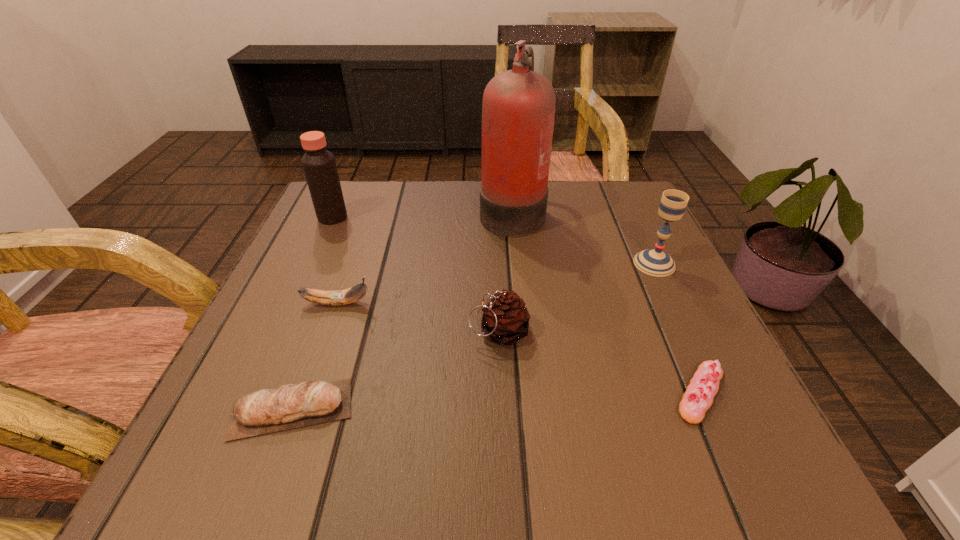
Where is `free area in between the fire extinguisher and the third farthest object`? The image size is (960, 540). free area in between the fire extinguisher and the third farthest object is located at coordinates (583, 237).

Image resolution: width=960 pixels, height=540 pixels. What are the coordinates of `vacant area that lies between the chalice and the tallest object` in the screenshot? It's located at [x=583, y=237].

Find the location of a particular element. This screenshot has width=960, height=540. vacant point located between the fifth tallest object and the fire extinguisher is located at coordinates (424, 257).

The image size is (960, 540). In order to click on free space between the eclair and the fourth tallest object in this screenshot , I will do `click(600, 362)`.

Find the location of a particular element. This screenshot has height=540, width=960. vacant point located between the vinegar and the tallest object is located at coordinates (422, 214).

You are a GUI agent. You are given a task and a screenshot of the screen. Output one action in this format:
    pyautogui.click(x=<x>, y=<y>)
    Task: Click on the empty space between the pita bread and the fourth shortest object
    
    Given the screenshot: What is the action you would take?
    pyautogui.click(x=396, y=370)

You are a GUI agent. You are given a task and a screenshot of the screen. Output one action in this format:
    pyautogui.click(x=<x>, y=<y>)
    Task: Click on the free space between the third nearest object and the sixth tallest object
    The width and height of the screenshot is (960, 540).
    Given the screenshot: What is the action you would take?
    pyautogui.click(x=396, y=370)

This screenshot has width=960, height=540. What are the coordinates of `unoccupied area between the fire extinguisher and the second tallest object` in the screenshot? It's located at (422, 214).

Identify the location of empty location between the fourth nearest object and the fourth tallest object. The width and height of the screenshot is (960, 540). (418, 318).

Identify the location of unoccupied area between the sixth tallest object and the fire extinguisher. (401, 310).